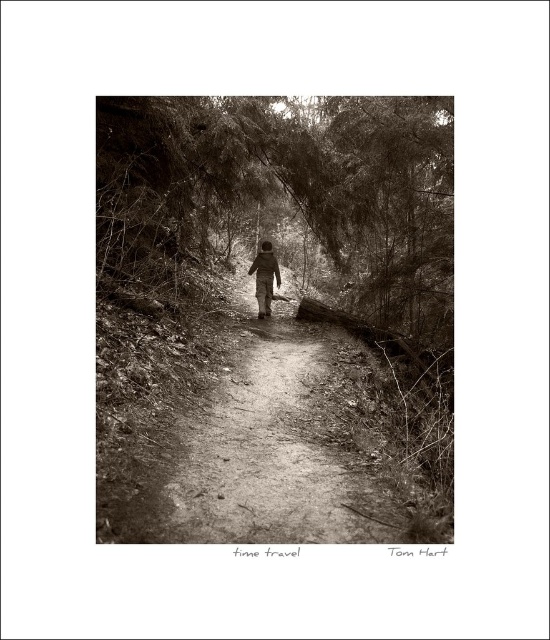
You are an observer in the scene. You notice the sepia textured forest at center and the matte black jacket at center. Which object takes up more space in the image?

The sepia textured forest at center is bigger than the matte black jacket at center, so it takes up more space in the image.

From the picture: You are standing on the dirt path in the forest and see the sepia textured forest at center and the matte black jacket at center. Which object is closer to you?

The sepia textured forest at center is closer to you because it is in front of the matte black jacket at center.